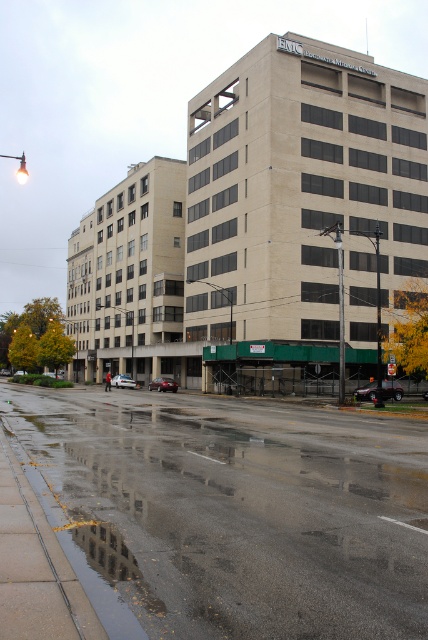
Question: Among these points, which one is nearest to the camera?

Choices:
 (A) (383, 387)
 (B) (162, 385)
 (C) (187, 625)
 (D) (127, 376)

Answer: (C)

Question: Which of these objects is positioned closest to the shiny black sedan at center?

Choices:
 (A) glossy asphalt road at lower center
 (B) white glossy sedan at center

Answer: (A)

Question: Can you confirm if glossy asphalt road at lower center is thinner than shiny red sedan at center?

Choices:
 (A) no
 (B) yes

Answer: (A)

Question: Is the position of shiny black sedan at center more distant than that of shiny red sedan at center?

Choices:
 (A) no
 (B) yes

Answer: (A)

Question: Can you confirm if glossy asphalt road at lower center is positioned above shiny red sedan at center?

Choices:
 (A) yes
 (B) no

Answer: (A)

Question: Which point is farther to the camera?

Choices:
 (A) glossy asphalt road at lower center
 (B) white glossy sedan at center

Answer: (B)